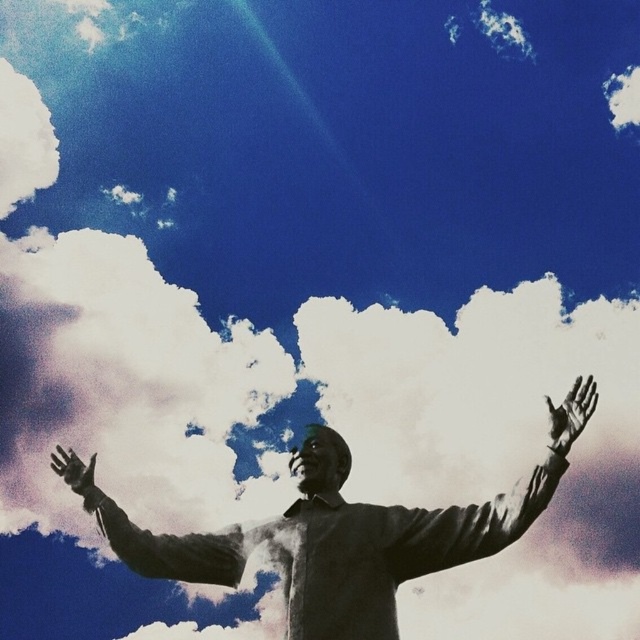
Question: Estimate the real-world distances between objects in this image. Which object is closer to the black matte arm at center?

Choices:
 (A) black matte hand at lower left
 (B) bronze statue at center
 (C) smooth black arm at center

Answer: (B)

Question: Among these objects, which one is farthest from the camera?

Choices:
 (A) smooth black arm at center
 (B) smooth skin hand at upper right

Answer: (A)

Question: Can you confirm if smooth black arm at center is positioned above black matte hand at lower left?

Choices:
 (A) yes
 (B) no

Answer: (B)

Question: Can you confirm if bronze statue at center is thinner than black matte hand at lower left?

Choices:
 (A) yes
 (B) no

Answer: (B)

Question: Which object is positioned closest to the bronze statue at center?

Choices:
 (A) smooth skin hand at upper right
 (B) black matte hand at lower left

Answer: (A)

Question: Where is bronze statue at center located in relation to smooth black arm at center in the image?

Choices:
 (A) left
 (B) right

Answer: (B)